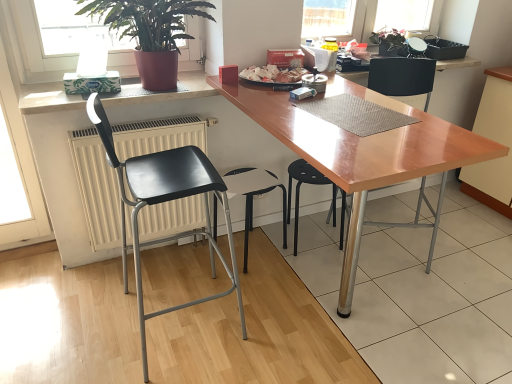
In order to click on vacant area that lies between wooden table at center and matte black chair at center, which is counted as the 1th chair, starting from the right in this screenshot , I will do `click(423, 273)`.